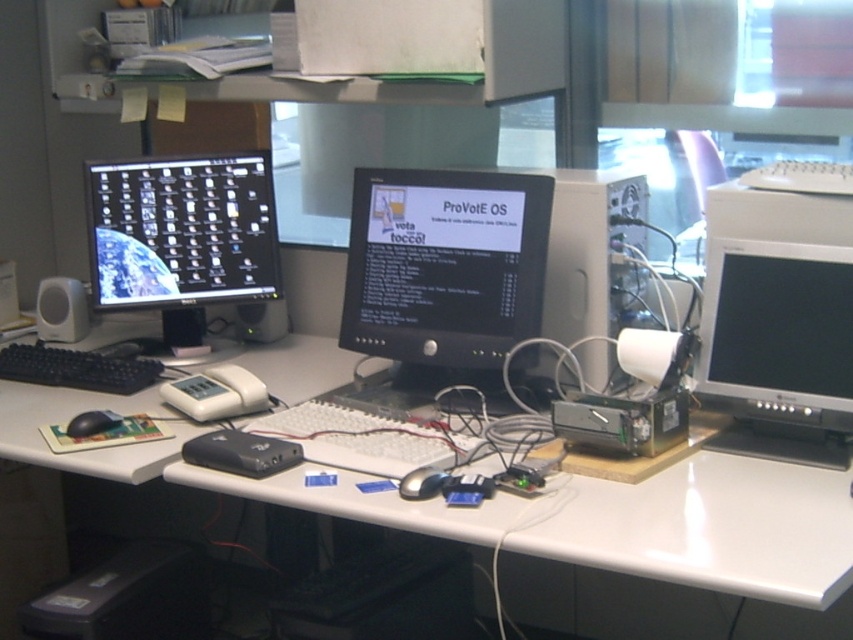
Can you confirm if black glossy monitor at center is taller than black matte mouse at lower left?

Correct, black glossy monitor at center is much taller as black matte mouse at lower left.

Looking at this image, can you confirm if black glossy monitor at center is positioned above black matte mouse at lower left?

Correct, black glossy monitor at center is located above black matte mouse at lower left.

Is point (408, 384) farther from camera compared to point (109, 426)?

Yes.

Locate an element on the screen. The width and height of the screenshot is (853, 640). black glossy monitor at center is located at coordinates (444, 272).

Does point (260, 305) lie behind point (64, 356)?

Yes, point (260, 305) is behind point (64, 356).

Is matte black monitor at left to the right of black matte keyboard at lower left from the viewer's perspective?

Indeed, matte black monitor at left is positioned on the right side of black matte keyboard at lower left.

This screenshot has height=640, width=853. Identify the location of matte black monitor at left. (186, 241).

At what (x,y) coordinates should I click in order to perform the action: click on matte black monitor at left. Please return your answer as a coordinate pair (x, y). Looking at the image, I should click on (186, 241).

The image size is (853, 640). In order to click on matte black monitor at right in this screenshot , I will do click(x=778, y=324).

Who is more forward, (822,273) or (440,474)?

Positioned in front is point (440,474).

You are a GUI agent. You are given a task and a screenshot of the screen. Output one action in this format:
    pyautogui.click(x=<x>, y=<y>)
    Task: Click on the matte black monitor at right
    The image size is (853, 640).
    Given the screenshot: What is the action you would take?
    pyautogui.click(x=778, y=324)